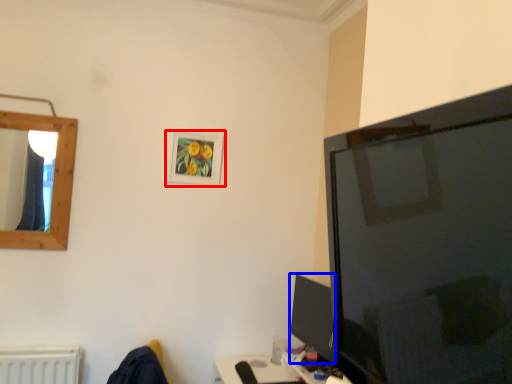
Question: Which object appears closest to the camera in this image, picture frame (highlighted by a red box) or tv show (highlighted by a blue box)?

Choices:
 (A) picture frame
 (B) tv show

Answer: (B)